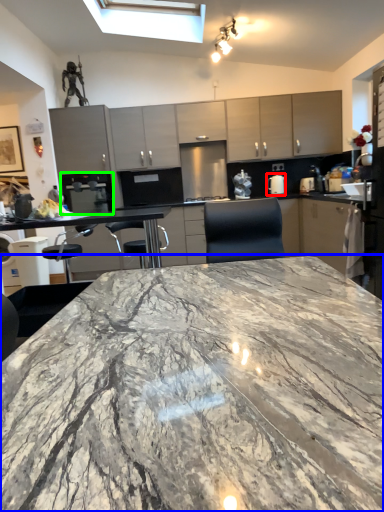
Question: Estimate the real-world distances between objects in this image. Which object is farther from appliance (highlighted by a red box), countertop (highlighted by a blue box) or appliance (highlighted by a green box)?

Choices:
 (A) countertop
 (B) appliance

Answer: (A)